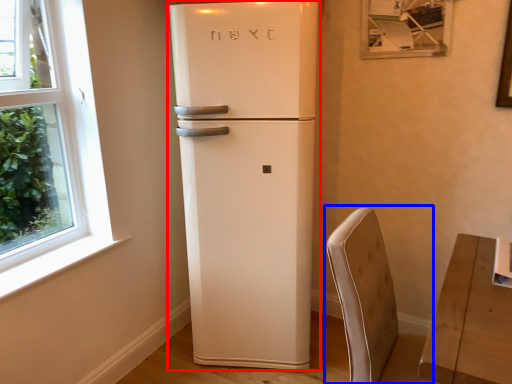
Question: Which object appears closest to the camera in this image, refrigerator (highlighted by a red box) or armchair (highlighted by a blue box)?

Choices:
 (A) refrigerator
 (B) armchair

Answer: (B)